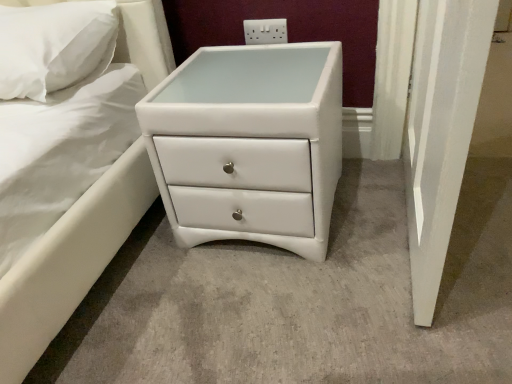
Question: Is white leather chest of drawers at center inside the boundaries of white plastic electric outlet at upper center, or outside?

Choices:
 (A) outside
 (B) inside

Answer: (A)

Question: Considering the positions of white leather chest of drawers at center and white plastic electric outlet at upper center in the image, is white leather chest of drawers at center wider or thinner than white plastic electric outlet at upper center?

Choices:
 (A) thin
 (B) wide

Answer: (B)

Question: Which object is the farthest from the white soft pillow at upper left?

Choices:
 (A) white leather chest of drawers at center
 (B) white plastic electric outlet at upper center

Answer: (B)

Question: Which of these objects is positioned farthest from the white plastic electric outlet at upper center?

Choices:
 (A) white leather chest of drawers at center
 (B) white soft pillow at upper left

Answer: (B)